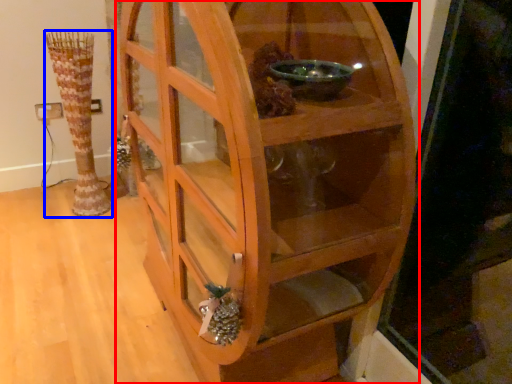
Question: Which of the following is the farthest to the observer, shelf (highlighted by a red box) or vase (highlighted by a blue box)?

Choices:
 (A) shelf
 (B) vase

Answer: (B)